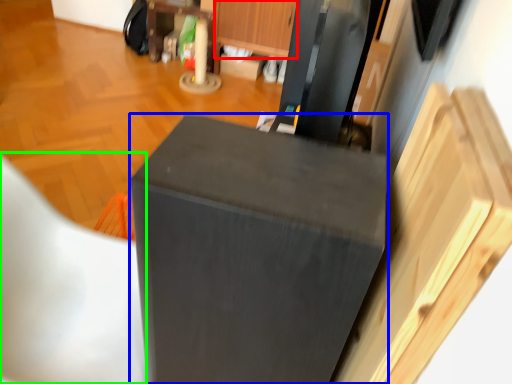
Question: Estimate the real-world distances between objects in this image. Which object is closer to drawer (highlighted by a red box), furniture (highlighted by a blue box) or folding chair (highlighted by a green box)?

Choices:
 (A) furniture
 (B) folding chair

Answer: (B)